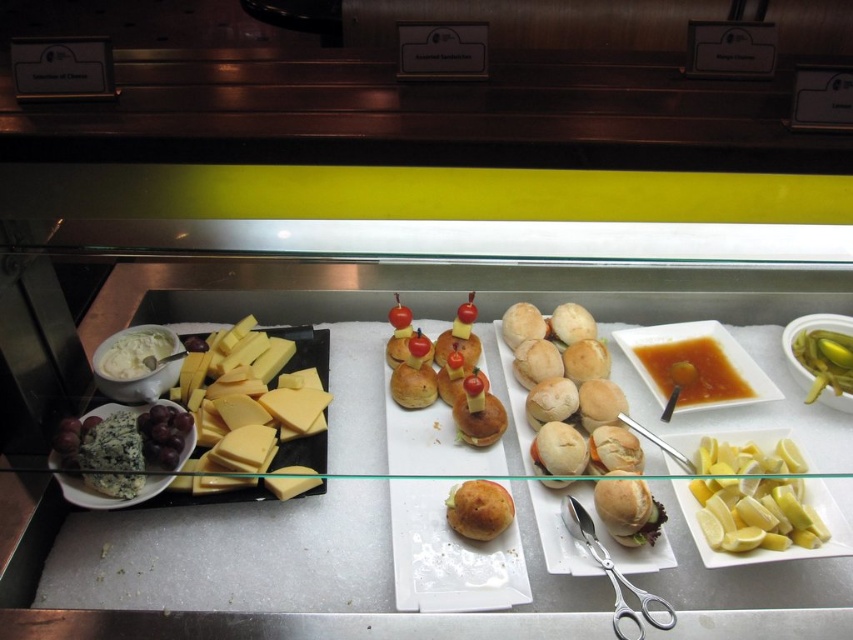
Question: Which point is closer to the camera?

Choices:
 (A) (689, 339)
 (B) (795, 349)
 (C) (115, 428)

Answer: (C)

Question: Among these objects, which one is nearest to the camera?

Choices:
 (A) golden brown bread roll at center
 (B) yellow hard cheese at left
 (C) white creamy spread at center left
 (D) silver metallic scissors at lower right

Answer: (D)

Question: Does golden brown bread roll at center have a lesser width compared to yellow glossy lemon at right?

Choices:
 (A) yes
 (B) no

Answer: (A)

Question: Which object is farther from the camera taking this photo?

Choices:
 (A) yellow hard cheese at left
 (B) blue crumbly cheese at lower left
 (C) golden brown bread roll at center

Answer: (C)

Question: Is yellow hard cheese at left smaller than blue crumbly cheese at lower left?

Choices:
 (A) yes
 (B) no

Answer: (B)

Question: Can you confirm if caramelized sauce at center is smaller than yellow glossy lemon at right?

Choices:
 (A) yes
 (B) no

Answer: (B)